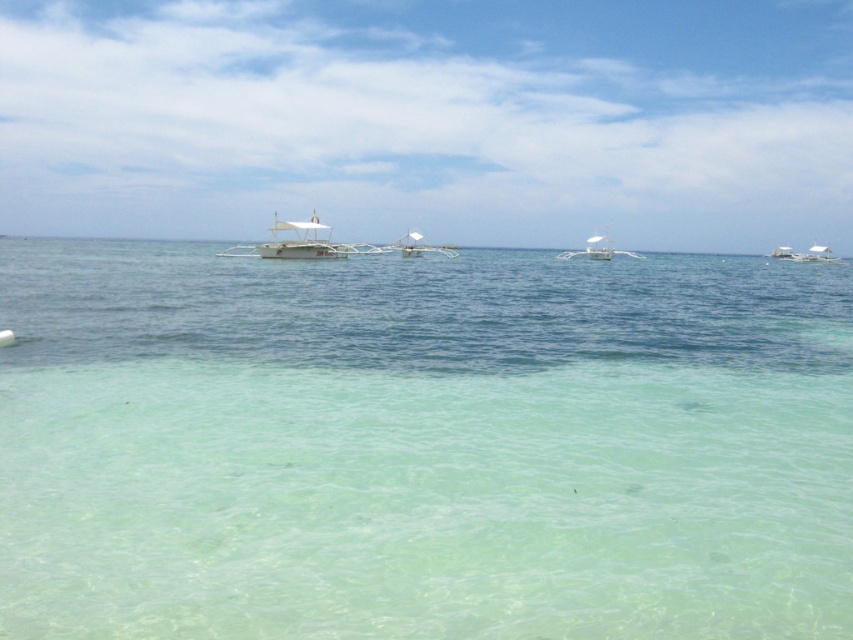
Based on the photo, you are a photographer planning to capture the reflection of the boats in the calm water. Since the white glossy boat at center and the white plastic boat at right are both in your view, which boat do you think will show a clearer reflection in the water?

The white glossy boat at center will show a clearer reflection in the water because it is positioned over the white plastic boat at right, making its surface smoother and more reflective.

From the picture: You are a photographer planning to capture the entire scene of the clear water at center and the white matte boat at center in one shot. Based on their sizes in the image, which one would you need to frame more carefully to ensure it doesn

The clear water at center occupies less space than the white matte boat at center, so you need to frame the clear water at center more carefully to ensure it is properly captured in the shot.

You are planning to take a short trip on the water. You have to choose between the white glossy boat at center and the white plastic boat at right. Which boat would be more stable in rougher waters?

The white plastic boat at right is wider than the white glossy boat at center, so it would be more stable in rougher waters.